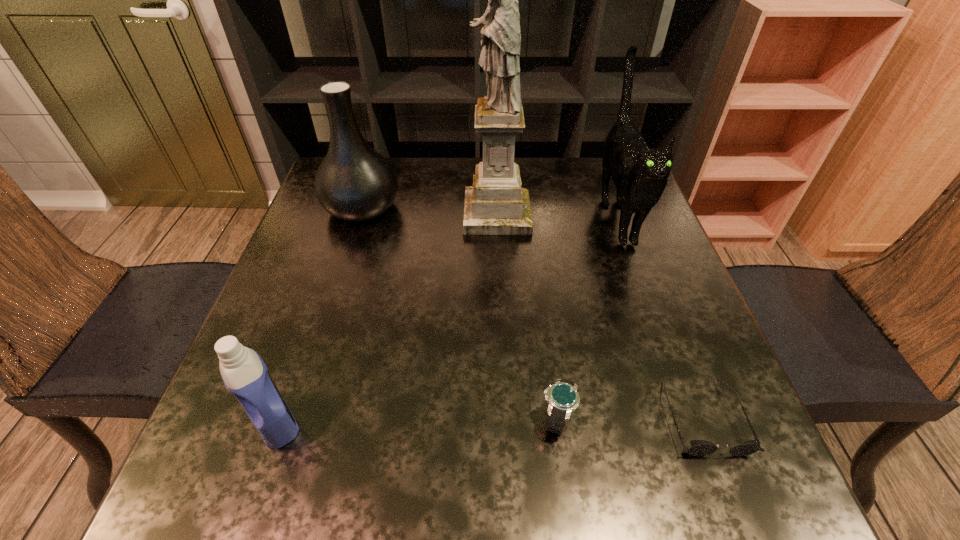
The height and width of the screenshot is (540, 960). I want to click on vacant region between the watch and the cat, so click(587, 316).

At what (x,y) coordinates should I click in order to perform the action: click on vacant space that's between the shortest object and the sculpture. Please return your answer as a coordinate pair (x, y). This screenshot has height=540, width=960. Looking at the image, I should click on (600, 315).

Identify which object is the third closest to the cat. Please provide its 2D coordinates. Your answer should be formatted as a tuple, i.e. [(x, y)], where the tuple contains the x and y coordinates of a point satisfying the conditions above.

[(562, 396)]

Where is `object that is the third nearest to the shortest object`? Image resolution: width=960 pixels, height=540 pixels. object that is the third nearest to the shortest object is located at coordinates (496, 204).

Identify the location of free space that satisfies the following two spatial constraints: 1. on the back side of the vase; 2. on the right side of the fourth tallest object. The height and width of the screenshot is (540, 960). (350, 208).

Find the location of a particular element. free spot that satisfies the following two spatial constraints: 1. on the front side of the watch; 2. on the left side of the vase is located at coordinates (296, 417).